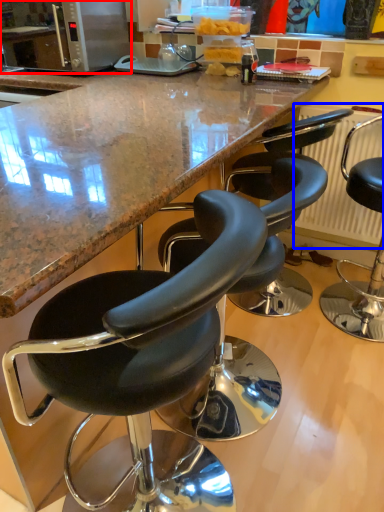
Question: Which object appears closest to the camera in this image, microwave oven (highlighted by a red box) or radiator (highlighted by a blue box)?

Choices:
 (A) microwave oven
 (B) radiator

Answer: (B)